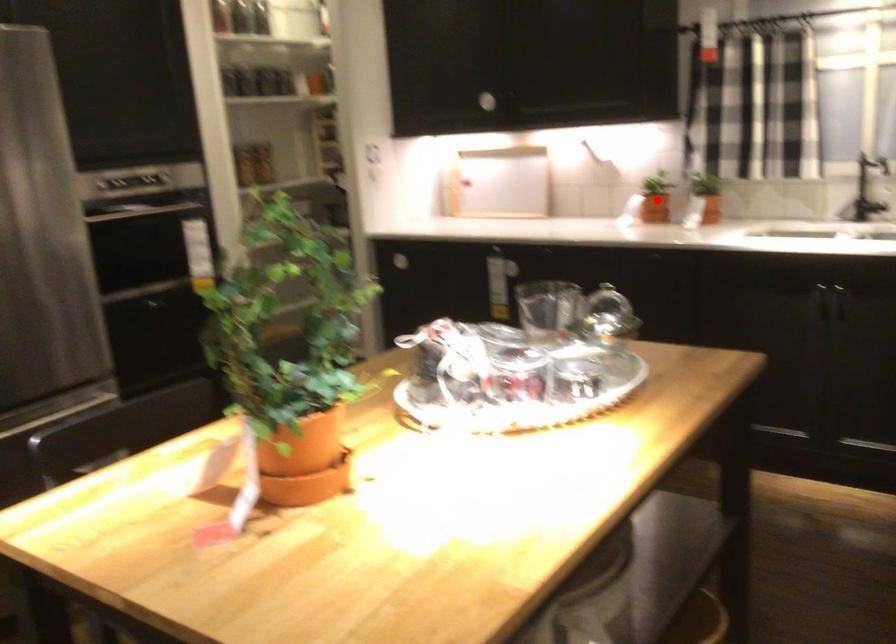
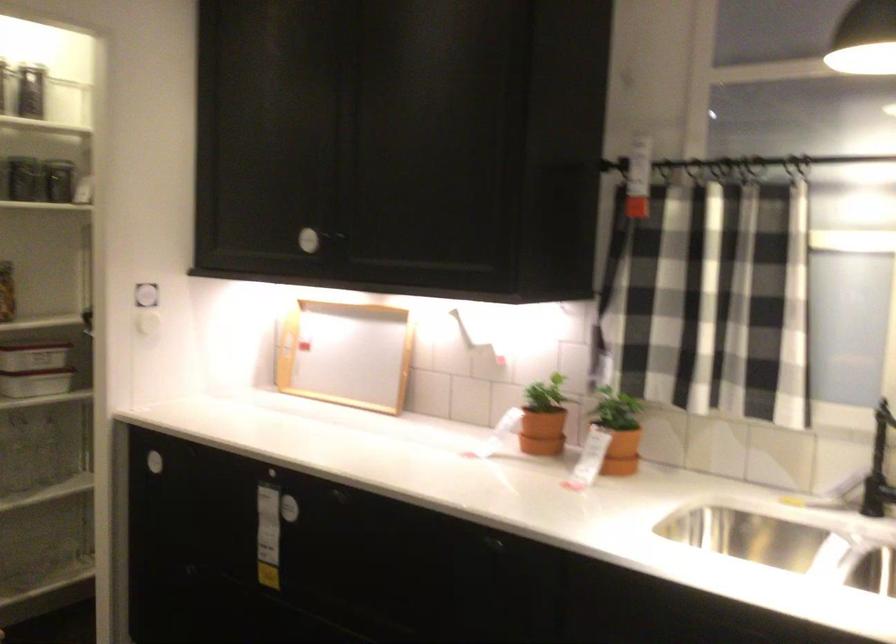
Where in the second image is the point corresponding to the highlighted location from the first image?

(541, 431)